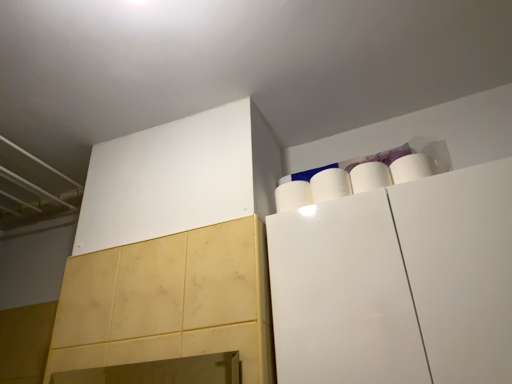
Locate an element on the screen. white matte paper towel at upper right, arranged as the first paper towel when viewed from the left is located at coordinates (293, 195).

The width and height of the screenshot is (512, 384). Describe the element at coordinates (293, 195) in the screenshot. I see `white matte paper towel at upper right, placed as the 3th paper towel when sorted from right to left` at that location.

Describe the element at coordinates (370, 177) in the screenshot. This screenshot has width=512, height=384. I see `white matte paper towel at upper right, the third paper towel in the left-to-right sequence` at that location.

Locate an element on the screen. The image size is (512, 384). white matte paper towel at upper right, placed as the 3th paper towel when sorted from right to left is located at coordinates (293, 195).

Considering the sizes of white matte paper towel at upper right, arranged as the first paper towel when viewed from the left, and white matte paper towel at upper right, the third paper towel in the left-to-right sequence, in the image, is white matte paper towel at upper right, arranged as the first paper towel when viewed from the left, wider or thinner than white matte paper towel at upper right, the third paper towel in the left-to-right sequence,?

white matte paper towel at upper right, arranged as the first paper towel when viewed from the left, is wider than white matte paper towel at upper right, the third paper towel in the left-to-right sequence.

From a real-world perspective, is white matte paper towel at upper right, placed as the 3th paper towel when sorted from right to left, physically located above or below white matte paper towel at upper right, which ranks as the 1th paper towel in right-to-left order?

Clearly, from a real-world perspective, white matte paper towel at upper right, placed as the 3th paper towel when sorted from right to left, is below white matte paper towel at upper right, which ranks as the 1th paper towel in right-to-left order.

Considering the positions of points (291, 204) and (365, 164), is point (291, 204) closer to camera compared to point (365, 164)?

Yes, point (291, 204) is closer to viewer.

Can you confirm if white matte paper towel at upper right, placed as the 3th paper towel when sorted from right to left, is smaller than white matte paper towel at upper right, which ranks as the 1th paper towel in right-to-left order?

Actually, white matte paper towel at upper right, placed as the 3th paper towel when sorted from right to left, might be larger than white matte paper towel at upper right, which ranks as the 1th paper towel in right-to-left order.

Which object is positioned more to the right, white matte paper towel at upper right, arranged as the 2th paper towel when viewed from the right, or white matte cabinet at upper right?

white matte cabinet at upper right.

How distant is white matte paper towel at upper right, arranged as the 2th paper towel when viewed from the right, from white matte cabinet at upper right?

9.45 inches.

From the image's perspective, which object appears higher, white matte paper towel at upper right, arranged as the 2th paper towel when viewed from the right, or white matte cabinet at upper right?

white matte paper towel at upper right, arranged as the 2th paper towel when viewed from the right, appears higher in the image.

This screenshot has width=512, height=384. In order to click on the 1st paper towel positioned above the white matte cabinet at upper right (from the image's perspective) in this screenshot , I will do `click(293, 195)`.

In the scene shown: Do you think white matte cabinet at upper right is within white matte paper towel at upper right, placed as the 3th paper towel when sorted from right to left, or outside of it?

white matte cabinet at upper right is outside white matte paper towel at upper right, placed as the 3th paper towel when sorted from right to left.

Considering the sizes of white matte cabinet at upper right and white matte paper towel at upper right, placed as the 3th paper towel when sorted from right to left, in the image, is white matte cabinet at upper right bigger or smaller than white matte paper towel at upper right, placed as the 3th paper towel when sorted from right to left,?

In the image, white matte cabinet at upper right appears to be larger than white matte paper towel at upper right, placed as the 3th paper towel when sorted from right to left.

Can you confirm if white matte cabinet at upper right is wider than white matte paper towel at upper right, placed as the 3th paper towel when sorted from right to left?

Yes.

Does white matte cabinet at upper right come in front of white matte paper towel at upper right, arranged as the 2th paper towel when viewed from the right?

That is True.

From a real-world perspective, between white matte cabinet at upper right and white matte paper towel at upper right, arranged as the 2th paper towel when viewed from the right, who is vertically lower?

From a 3D spatial view, white matte cabinet at upper right is below.

Looking at this image, is white matte cabinet at upper right spatially inside white matte paper towel at upper right, arranged as the 2th paper towel when viewed from the right, or outside of it?

white matte cabinet at upper right is outside white matte paper towel at upper right, arranged as the 2th paper towel when viewed from the right.

Is white matte cabinet at upper right oriented away from white matte paper towel at upper right, arranged as the 2th paper towel when viewed from the right?

No, white matte paper towel at upper right, arranged as the 2th paper towel when viewed from the right, is not at the back of white matte cabinet at upper right.

How many degrees apart are the facing directions of white matte paper towel at upper right, which ranks as the 1th paper towel in right-to-left order, and white matte paper towel at upper right, arranged as the 2th paper towel when viewed from the right?

The angular difference between white matte paper towel at upper right, which ranks as the 1th paper towel in right-to-left order, and white matte paper towel at upper right, arranged as the 2th paper towel when viewed from the right, is 0.214 degrees.

Between white matte paper towel at upper right, the third paper towel in the left-to-right sequence, and white matte paper towel at upper right, which is the second paper towel from left to right, which one is positioned in front?

white matte paper towel at upper right, the third paper towel in the left-to-right sequence, is closer to the camera.

Would you consider white matte paper towel at upper right, which ranks as the 1th paper towel in right-to-left order, to be distant from white matte paper towel at upper right, which is the second paper towel from left to right?

No.

From a real-world perspective, count 2nd paper towels downward from the white matte paper towel at upper right, the third paper towel in the left-to-right sequence, and point to it. Please provide its 2D coordinates.

[(330, 185)]

From a real-world perspective, which is physically above, white matte cabinet at upper right or white matte paper towel at upper right, which ranks as the 1th paper towel in right-to-left order?

white matte paper towel at upper right, which ranks as the 1th paper towel in right-to-left order, is physically above.

From the image's perspective, is white matte cabinet at upper right above or below white matte paper towel at upper right, which ranks as the 1th paper towel in right-to-left order?

white matte cabinet at upper right is below white matte paper towel at upper right, which ranks as the 1th paper towel in right-to-left order.

Is white matte cabinet at upper right placed right next to white matte paper towel at upper right, the third paper towel in the left-to-right sequence?

white matte cabinet at upper right is not next to white matte paper towel at upper right, the third paper towel in the left-to-right sequence, and they're not touching.

Is white matte cabinet at upper right smaller than white matte paper towel at upper right, which ranks as the 1th paper towel in right-to-left order?

Incorrect, white matte cabinet at upper right is not smaller in size than white matte paper towel at upper right, which ranks as the 1th paper towel in right-to-left order.

Can you confirm if white matte paper towel at upper right, which ranks as the 1th paper towel in right-to-left order, is smaller than white matte cabinet at upper right?

Indeed, white matte paper towel at upper right, which ranks as the 1th paper towel in right-to-left order, has a smaller size compared to white matte cabinet at upper right.

From the picture: Can you confirm if white matte paper towel at upper right, which ranks as the 1th paper towel in right-to-left order, is taller than white matte cabinet at upper right?

No, white matte paper towel at upper right, which ranks as the 1th paper towel in right-to-left order, is not taller than white matte cabinet at upper right.

Considering the points (389, 171) and (352, 270), which point is in front, point (389, 171) or point (352, 270)?

The point (352, 270) is more forward.

From the picture: Between white matte paper towel at upper right, the third paper towel in the left-to-right sequence, and white matte cabinet at upper right, which one appears on the left side from the viewer's perspective?

Positioned to the left is white matte paper towel at upper right, the third paper towel in the left-to-right sequence.

This screenshot has width=512, height=384. Find the location of `the 2nd paper towel above when counting from the white matte paper towel at upper right, arranged as the first paper towel when viewed from the left (from the image's perspective)`. the 2nd paper towel above when counting from the white matte paper towel at upper right, arranged as the first paper towel when viewed from the left (from the image's perspective) is located at coordinates (370, 177).

Which paper towel is the 2nd one when counting from the left side of the white matte cabinet at upper right? Please provide its 2D coordinates.

[(330, 185)]

Looking at the image, which one is located closer to white matte cabinet at upper right, white matte paper towel at upper right, which is the second paper towel from left to right, or white matte paper towel at upper right, the third paper towel in the left-to-right sequence?

The object closer to white matte cabinet at upper right is white matte paper towel at upper right, which is the second paper towel from left to right.

Estimate the real-world distances between objects in this image. Which object is closer to white matte paper towel at upper right, which is the second paper towel from left to right, white matte cabinet at upper right or white matte paper towel at upper right, arranged as the first paper towel when viewed from the left?

white matte paper towel at upper right, arranged as the first paper towel when viewed from the left, lies closer to white matte paper towel at upper right, which is the second paper towel from left to right, than the other object.

Which object lies further to the anchor point white matte cabinet at upper right, white matte paper towel at upper right, the third paper towel in the left-to-right sequence, or white matte paper towel at upper right, which is the second paper towel from left to right?

Among the two, white matte paper towel at upper right, the third paper towel in the left-to-right sequence, is located further to white matte cabinet at upper right.

Based on their spatial positions, is white matte cabinet at upper right or white matte paper towel at upper right, which is the second paper towel from left to right, closer to white matte paper towel at upper right, the third paper towel in the left-to-right sequence?

Answer: white matte paper towel at upper right, which is the second paper towel from left to right, lies closer to white matte paper towel at upper right, the third paper towel in the left-to-right sequence, than the other object.

Based on their spatial positions, is white matte paper towel at upper right, arranged as the 2th paper towel when viewed from the right, or white matte paper towel at upper right, placed as the 3th paper towel when sorted from right to left, further from white matte cabinet at upper right?

white matte paper towel at upper right, placed as the 3th paper towel when sorted from right to left.

Based on their spatial positions, is white matte paper towel at upper right, arranged as the 2th paper towel when viewed from the right, or white matte paper towel at upper right, the third paper towel in the left-to-right sequence, further from white matte paper towel at upper right, placed as the 3th paper towel when sorted from right to left?

The object further to white matte paper towel at upper right, placed as the 3th paper towel when sorted from right to left, is white matte paper towel at upper right, the third paper towel in the left-to-right sequence.

From the image, which object appears to be farther from white matte paper towel at upper right, the third paper towel in the left-to-right sequence, white matte paper towel at upper right, placed as the 3th paper towel when sorted from right to left, or white matte cabinet at upper right?

white matte cabinet at upper right is further to white matte paper towel at upper right, the third paper towel in the left-to-right sequence.

Consider the image. From the image, which object appears to be nearer to white matte cabinet at upper right, white matte paper towel at upper right, placed as the 3th paper towel when sorted from right to left, or white matte paper towel at upper right, the third paper towel in the left-to-right sequence?

white matte paper towel at upper right, the third paper towel in the left-to-right sequence, lies closer to white matte cabinet at upper right than the other object.

Where is `paper towel between white matte paper towel at upper right, arranged as the first paper towel when viewed from the left, and white matte paper towel at upper right, which ranks as the 1th paper towel in right-to-left order, in the horizontal direction`? The height and width of the screenshot is (384, 512). paper towel between white matte paper towel at upper right, arranged as the first paper towel when viewed from the left, and white matte paper towel at upper right, which ranks as the 1th paper towel in right-to-left order, in the horizontal direction is located at coordinates (330, 185).

I want to click on paper towel between white matte cabinet at upper right and white matte paper towel at upper right, arranged as the 2th paper towel when viewed from the right, along the z-axis, so click(x=370, y=177).